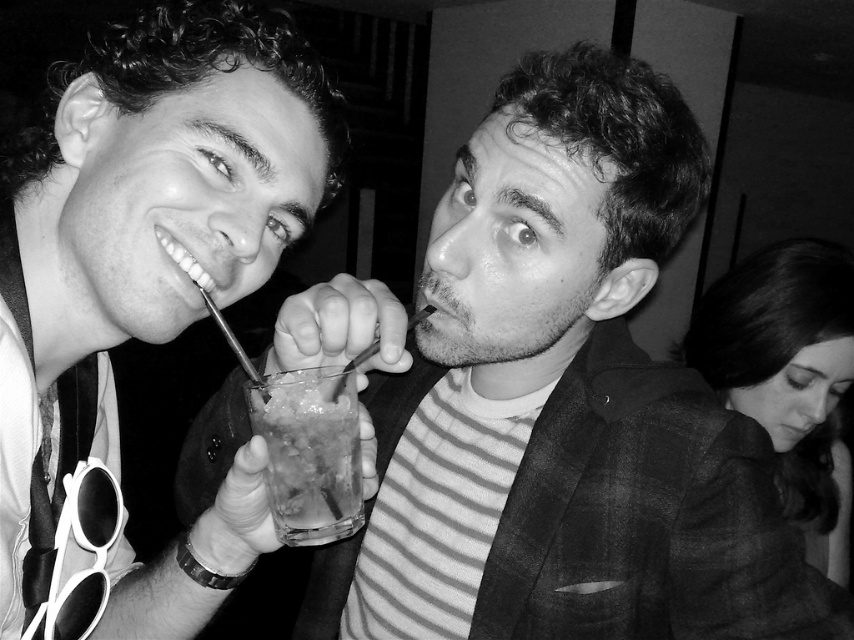
Question: Which object appears farthest from the camera in this image?

Choices:
 (A) striped fabric shirt at center
 (B) translucent glass at center

Answer: (B)

Question: Which point is farther to the camera?

Choices:
 (A) matte black drink at center
 (B) striped fabric shirt at center

Answer: (B)

Question: Is striped fabric shirt at center positioned at the back of translucent glass at center?

Choices:
 (A) no
 (B) yes

Answer: (A)

Question: Which point is closer to the camera?

Choices:
 (A) (562, 225)
 (B) (272, 547)
 (C) (338, 390)

Answer: (C)

Question: Can you confirm if matte black drink at center is positioned above translucent glass at center?

Choices:
 (A) yes
 (B) no

Answer: (A)

Question: From the image, what is the correct spatial relationship of matte black drink at center in relation to translucent glass at center?

Choices:
 (A) right
 (B) left

Answer: (B)